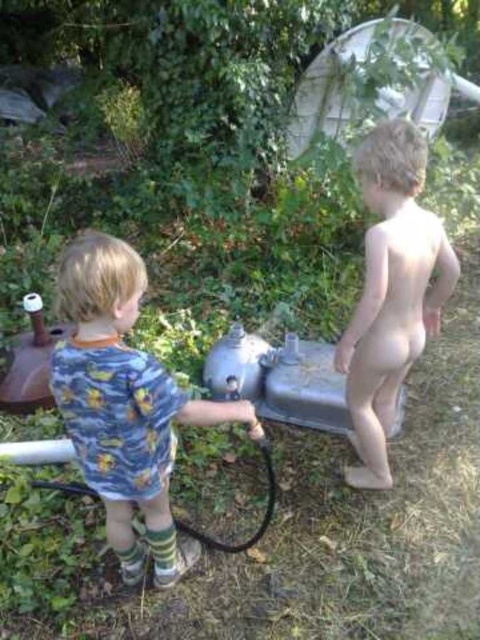
What do you see at coordinates (124, 404) in the screenshot? The height and width of the screenshot is (640, 480). I see `blue printed shirt at center` at bounding box center [124, 404].

What are the coordinates of `blue printed shirt at center` in the screenshot? It's located at (124, 404).

Who is taller, pale skin nude boy at right or black rubber hose at lower left?

pale skin nude boy at right

Is pale skin nude boy at right taller than black rubber hose at lower left?

Indeed, pale skin nude boy at right has a greater height compared to black rubber hose at lower left.

Is point (393, 253) in front of point (86, 488)?

Yes.

Find the location of a particular element. pale skin nude boy at right is located at coordinates (391, 291).

Which is more to the right, blue printed shirt at center or black rubber hose at lower left?

black rubber hose at lower left is more to the right.

Is point (126, 259) in front of point (266, 464)?

Yes, point (126, 259) is closer to viewer.

Where is `blue printed shirt at center`? Image resolution: width=480 pixels, height=640 pixels. blue printed shirt at center is located at coordinates (124, 404).